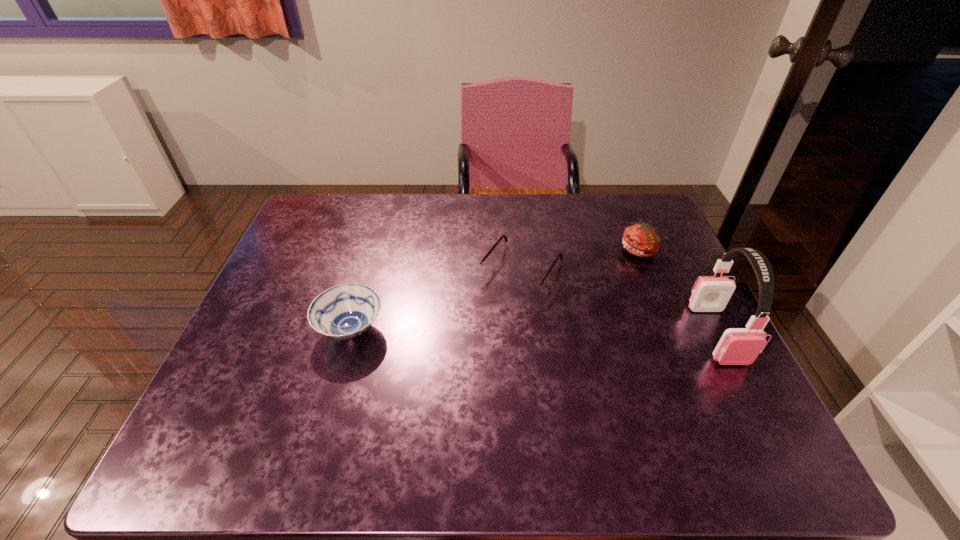
Find the location of a particular element. vacant space on the desktop that is between the soup bowl and the earphone and is positioned on the front-facing side of the tomato is located at coordinates (565, 332).

You are a GUI agent. You are given a task and a screenshot of the screen. Output one action in this format:
    pyautogui.click(x=<x>, y=<y>)
    Task: Click on the vacant space on the desktop that is between the leftmost object and the tallest object and is positioned at the hinge ends of the spectacles
    The height and width of the screenshot is (540, 960).
    Given the screenshot: What is the action you would take?
    pyautogui.click(x=479, y=331)